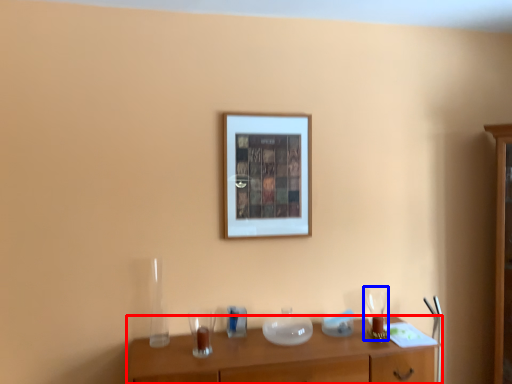
Question: Which point is closer to the camera, table (highlighted by a red box) or wine glass (highlighted by a blue box)?

Choices:
 (A) table
 (B) wine glass

Answer: (A)